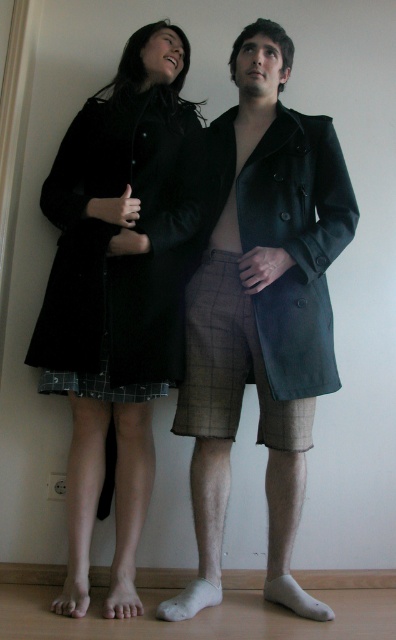
Question: Can you confirm if matte black dress at center is positioned to the left of matte black coat at center?

Choices:
 (A) yes
 (B) no

Answer: (A)

Question: Is matte black dress at center wider than matte black coat at center?

Choices:
 (A) yes
 (B) no

Answer: (A)

Question: Which object is positioned closest to the brown checkered kilt at center?

Choices:
 (A) matte black coat at center
 (B) plaid fabric kilt at lower center

Answer: (A)

Question: Which object is the farthest from the brown checkered kilt at center?

Choices:
 (A) matte black coat at center
 (B) matte black dress at center
 (C) plaid fabric kilt at lower center

Answer: (B)

Question: Can you confirm if matte black dress at center is positioned below plaid fabric kilt at lower center?

Choices:
 (A) yes
 (B) no

Answer: (B)

Question: Considering the real-world distances, which object is closest to the matte black coat at center?

Choices:
 (A) matte black dress at center
 (B) plaid fabric kilt at lower center
 (C) brown checkered kilt at center

Answer: (C)